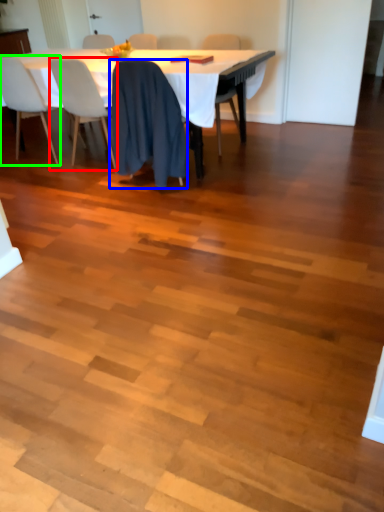
Question: Which object is positioned closest to chair (highlighted by a red box)? Select from chair (highlighted by a blue box) and chair (highlighted by a green box).

Choices:
 (A) chair
 (B) chair

Answer: (B)